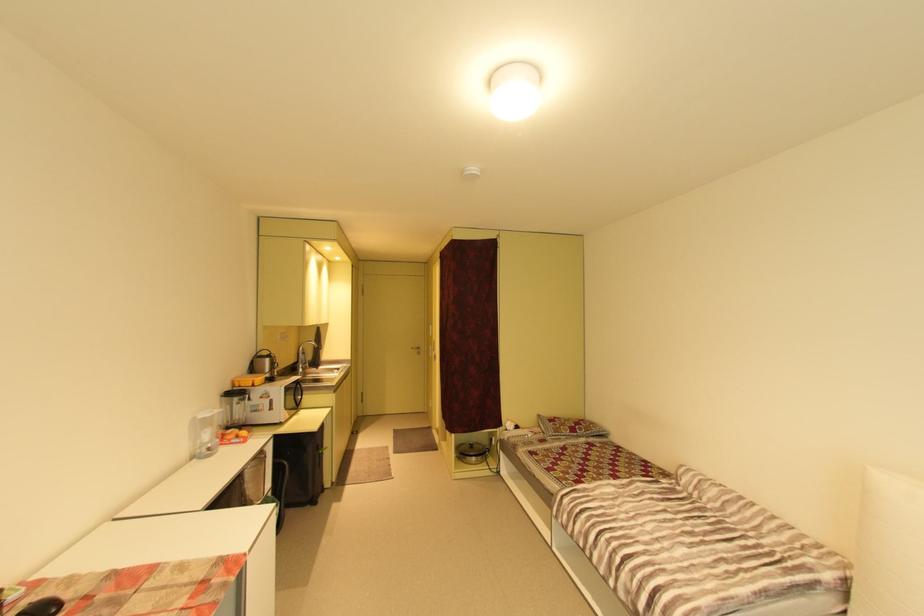
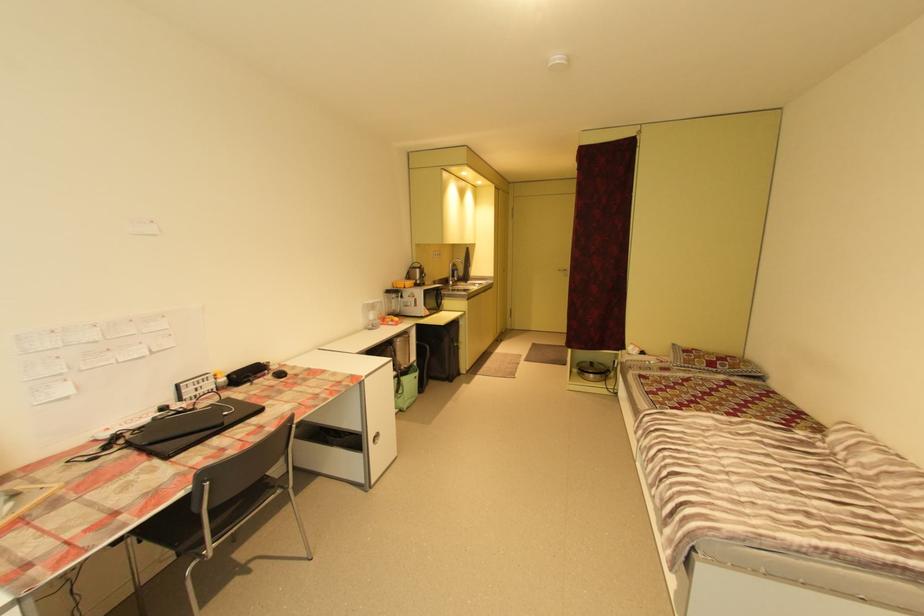
The point at [210,419] is marked in the first image. Where is the corresponding point in the second image?

(374, 304)